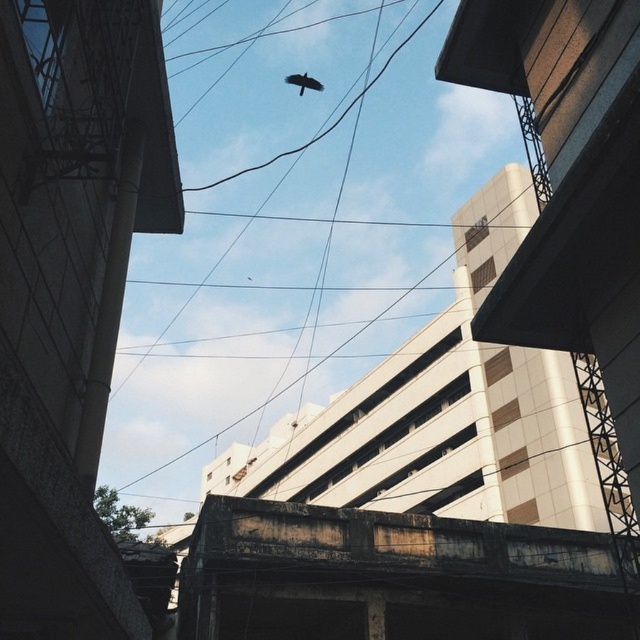
Is point (445, 628) more distant than point (310, 81)?

No.

Does rusty concrete overpass at center appear on the left side of dark brown feathered bird at center?

Incorrect, rusty concrete overpass at center is not on the left side of dark brown feathered bird at center.

The width and height of the screenshot is (640, 640). What do you see at coordinates (394, 577) in the screenshot?
I see `rusty concrete overpass at center` at bounding box center [394, 577].

At what (x,y) coordinates should I click in order to perform the action: click on rusty concrete overpass at center. Please return your answer as a coordinate pair (x, y). Looking at the image, I should click on (394, 577).